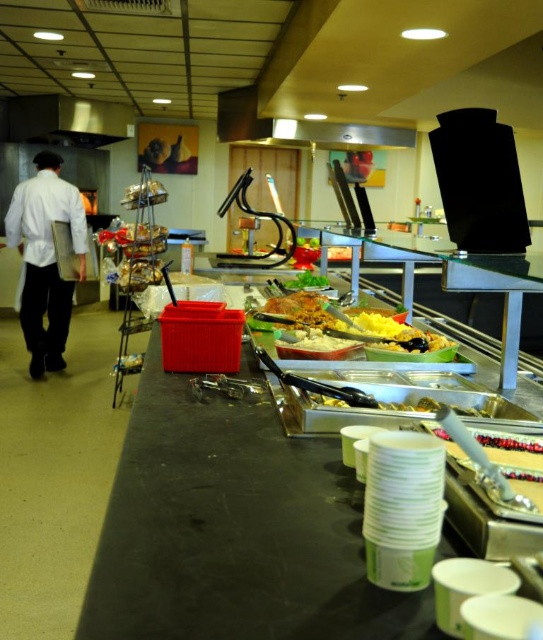
Question: Is translucent plastic cups at lower right wider than white creamy mashed potatoes at center?

Choices:
 (A) yes
 (B) no

Answer: (B)

Question: Does yellow matte food at center appear on the left side of white creamy mashed potatoes at center?

Choices:
 (A) no
 (B) yes

Answer: (A)

Question: Does translucent plastic cups at lower right appear under white creamy mashed potatoes at center?

Choices:
 (A) no
 (B) yes

Answer: (B)

Question: Which of the following is the closest to the observer?

Choices:
 (A) (324, 321)
 (B) (539, 512)

Answer: (B)

Question: Among these objects, which one is nearest to the camera?

Choices:
 (A) white matte uniform at left
 (B) shiny orange pasta at center
 (C) white creamy mashed potatoes at center
 (D) translucent plastic cups at lower right

Answer: (D)

Question: Which point is farther to the camera?

Choices:
 (A) (22, 307)
 (B) (515, 460)
 (C) (426, 337)
 (D) (336, 339)

Answer: (A)